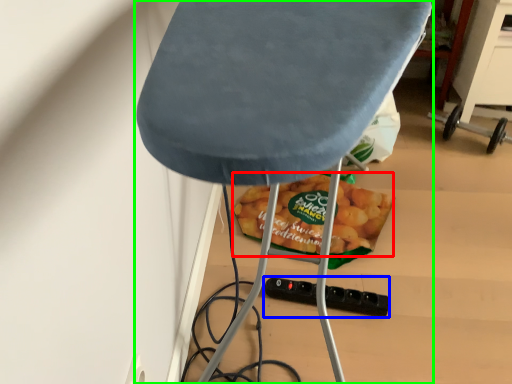
Question: Which object is the farthest from snack (highlighted by a red box)? Choose among these: socket (highlighted by a blue box) or furniture (highlighted by a green box).

Choices:
 (A) socket
 (B) furniture

Answer: (B)